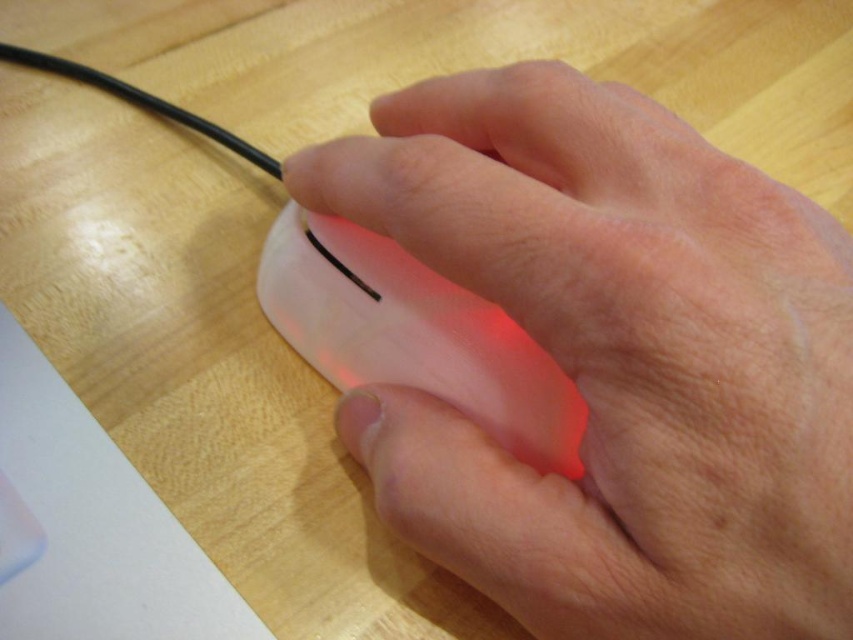
You are setting up a workspace and have two mice to choose from. The white matte mouse at center and the translucent plastic mouse at center. Which one is wider?

The white matte mouse at center is wider than the translucent plastic mouse at center according to the description.

From the picture: You are a graphic designer working on a project. You need to place a new element exactly at the center of your workspace. The workspace has a white matte mouse at center located at point (614, 358). Can you confirm if the mouse is exactly at the center point of the workspace?

The white matte mouse at center is located at point (614, 358), so yes, the mouse is exactly at the center point of the workspace.

You are trying to determine which point is closer to you in the image. Given that you are looking at the hand and mouse setup, which of the two points, point (339,429) or point (299,332), is closer to your viewpoint?

Point (339,429) is closer to the viewer than point (299,332) according to the description.